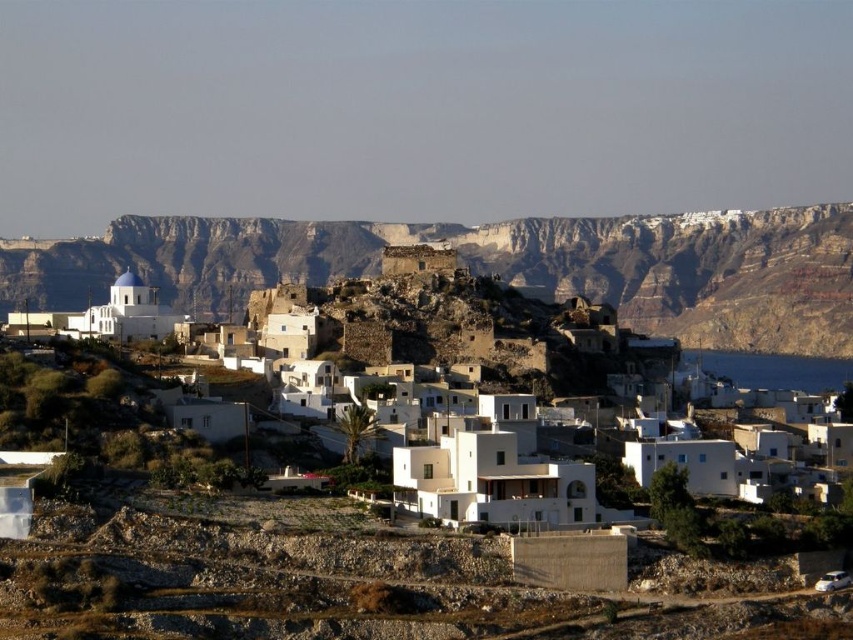
Is white stone buildings at center below blue water at lower right?

No.

Does white stone buildings at center have a larger size compared to blue water at lower right?

Actually, white stone buildings at center might be smaller than blue water at lower right.

Does point (534, 310) lie behind point (811, 356)?

No, it is in front of (811, 356).

Where is `white stone buildings at center`? The height and width of the screenshot is (640, 853). white stone buildings at center is located at coordinates [454, 326].

Between rugged stone cliff at center and white stone buildings at center, which one has less height?

white stone buildings at center is shorter.

Does rugged stone cliff at center appear on the left side of white stone buildings at center?

Incorrect, rugged stone cliff at center is not on the left side of white stone buildings at center.

You are a GUI agent. You are given a task and a screenshot of the screen. Output one action in this format:
    pyautogui.click(x=<x>, y=<y>)
    Task: Click on the rugged stone cliff at center
    This screenshot has height=640, width=853.
    Given the screenshot: What is the action you would take?
    pyautogui.click(x=497, y=266)

You are a GUI agent. You are given a task and a screenshot of the screen. Output one action in this format:
    pyautogui.click(x=<x>, y=<y>)
    Task: Click on the rugged stone cliff at center
    
    Given the screenshot: What is the action you would take?
    pyautogui.click(x=497, y=266)

Who is positioned more to the left, rugged stone cliff at center or blue water at lower right?

rugged stone cliff at center

Is point (328, 221) positioned after point (828, 365)?

Yes, point (328, 221) is behind point (828, 365).

What do you see at coordinates (497, 266) in the screenshot? This screenshot has width=853, height=640. I see `rugged stone cliff at center` at bounding box center [497, 266].

Image resolution: width=853 pixels, height=640 pixels. Identify the location of rugged stone cliff at center. (497, 266).